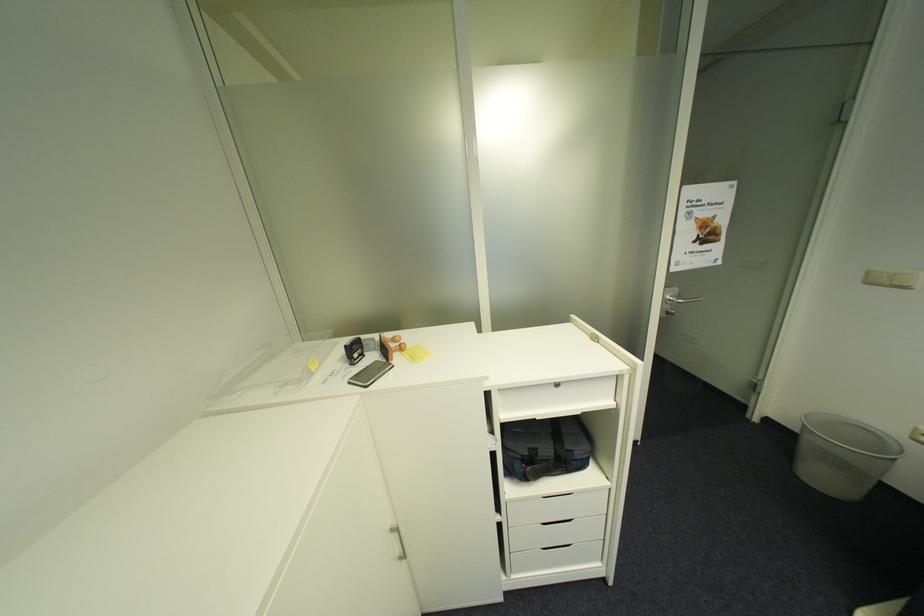
You are a GUI agent. You are given a task and a screenshot of the screen. Output one action in this format:
    pyautogui.click(x=<x>, y=<y>)
    Task: Click on the drawer lock
    
    Given the screenshot: What is the action you would take?
    pyautogui.click(x=555, y=384)